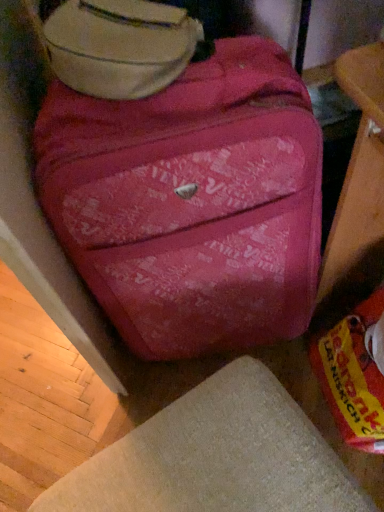
Image resolution: width=384 pixels, height=512 pixels. What do you see at coordinates (216, 457) in the screenshot?
I see `beige fabric ottoman at lower center` at bounding box center [216, 457].

The image size is (384, 512). In order to click on matte pink suitcase at center in this screenshot , I will do tap(191, 202).

Identify the location of beige fabric ottoman at lower center. This screenshot has height=512, width=384. (216, 457).

Do you think matte pink suitcase at center is within matte pink suitcase at upper center, or outside of it?

matte pink suitcase at center lies outside matte pink suitcase at upper center.

How different are the orientations of matte pink suitcase at center and matte pink suitcase at upper center in degrees?

The angular difference between matte pink suitcase at center and matte pink suitcase at upper center is 2.59 degrees.

Is the depth of matte pink suitcase at center greater than that of matte pink suitcase at upper center?

No, it is not.

How distant is matte pink suitcase at center from matte pink suitcase at upper center?

A distance of 8.95 inches exists between matte pink suitcase at center and matte pink suitcase at upper center.

Considering the sizes of objects matte pink suitcase at upper center and beige fabric ottoman at lower center in the image provided, who is smaller, matte pink suitcase at upper center or beige fabric ottoman at lower center?

matte pink suitcase at upper center is smaller.

In the image, is matte pink suitcase at upper center positioned in front of or behind beige fabric ottoman at lower center?

In the image, matte pink suitcase at upper center appears behind beige fabric ottoman at lower center.

Is matte pink suitcase at upper center at the right side of beige fabric ottoman at lower center?

Incorrect, matte pink suitcase at upper center is not on the right side of beige fabric ottoman at lower center.

This screenshot has height=512, width=384. I want to click on suitcase above the beige fabric ottoman at lower center (from the image's perspective), so click(x=191, y=202).

From the image's perspective, is beige fabric ottoman at lower center above matte pink suitcase at center?

No.

Does beige fabric ottoman at lower center appear on the left side of matte pink suitcase at center?

Yes.

Considering the positions of objects beige fabric ottoman at lower center and matte pink suitcase at upper center in the image provided, who is more to the right, beige fabric ottoman at lower center or matte pink suitcase at upper center?

From the viewer's perspective, beige fabric ottoman at lower center appears more on the right side.

Is beige fabric ottoman at lower center positioned far away from matte pink suitcase at upper center?

beige fabric ottoman at lower center is actually quite close to matte pink suitcase at upper center.

Is beige fabric ottoman at lower center wider than matte pink suitcase at upper center?

Indeed, beige fabric ottoman at lower center has a greater width compared to matte pink suitcase at upper center.

Between matte pink suitcase at upper center and matte pink suitcase at center, which one is positioned in front?

matte pink suitcase at center is in front.

Which is correct: matte pink suitcase at upper center is inside matte pink suitcase at center, or outside of it?

matte pink suitcase at upper center is spatially situated outside matte pink suitcase at center.

Is matte pink suitcase at upper center not close to matte pink suitcase at center?

No, matte pink suitcase at upper center is in close proximity to matte pink suitcase at center.

Between matte pink suitcase at center and beige fabric ottoman at lower center, which one has smaller width?

With smaller width is matte pink suitcase at center.

Is matte pink suitcase at center far from beige fabric ottoman at lower center?

No, matte pink suitcase at center is not far away from beige fabric ottoman at lower center.

Based on the photo, how distant is matte pink suitcase at center from beige fabric ottoman at lower center?

11.95 inches.

Considering the relative sizes of matte pink suitcase at center and beige fabric ottoman at lower center in the image provided, is matte pink suitcase at center smaller than beige fabric ottoman at lower center?

Actually, matte pink suitcase at center might be larger than beige fabric ottoman at lower center.

The image size is (384, 512). I want to click on luggage located above the matte pink suitcase at center (from the image's perspective), so click(x=119, y=46).

Image resolution: width=384 pixels, height=512 pixels. I want to click on luggage that appears on the left of beige fabric ottoman at lower center, so click(x=119, y=46).

When comparing their distances from beige fabric ottoman at lower center, does matte pink suitcase at center or matte pink suitcase at upper center seem further?

Among the two, matte pink suitcase at upper center is located further to beige fabric ottoman at lower center.

Estimate the real-world distances between objects in this image. Which object is further from matte pink suitcase at center, matte pink suitcase at upper center or beige fabric ottoman at lower center?

beige fabric ottoman at lower center is further to matte pink suitcase at center.

Based on their spatial positions, is beige fabric ottoman at lower center or matte pink suitcase at upper center further from matte pink suitcase at center?

beige fabric ottoman at lower center.

When comparing their distances from matte pink suitcase at upper center, does matte pink suitcase at center or beige fabric ottoman at lower center seem further?

Among the two, beige fabric ottoman at lower center is located further to matte pink suitcase at upper center.

Considering their positions, is matte pink suitcase at upper center positioned closer to beige fabric ottoman at lower center than matte pink suitcase at center?

The object closer to beige fabric ottoman at lower center is matte pink suitcase at center.

Looking at the image, which one is located closer to matte pink suitcase at upper center, beige fabric ottoman at lower center or matte pink suitcase at center?

matte pink suitcase at center is positioned closer to the anchor matte pink suitcase at upper center.

Identify the location of suitcase between matte pink suitcase at upper center and beige fabric ottoman at lower center in the up-down direction. This screenshot has height=512, width=384. coord(191,202).